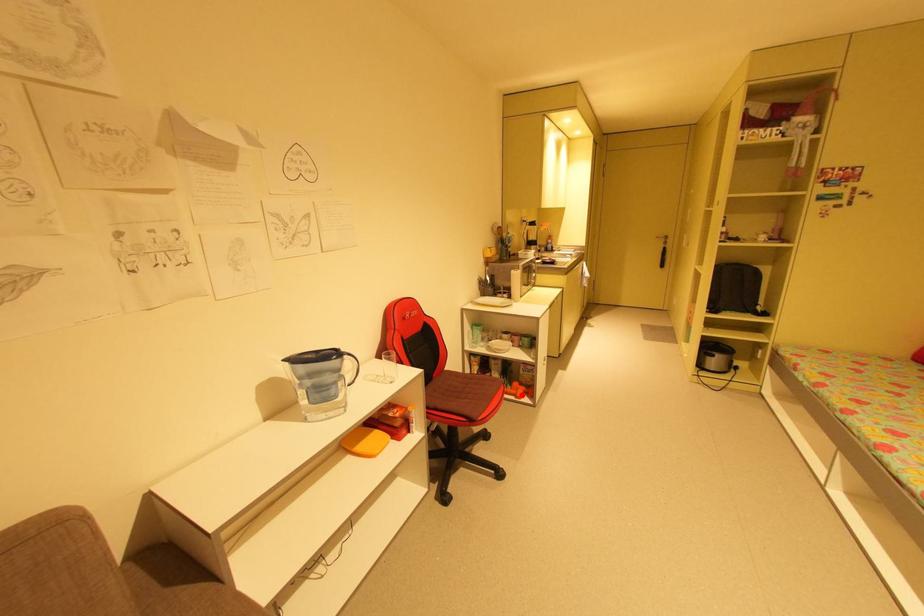
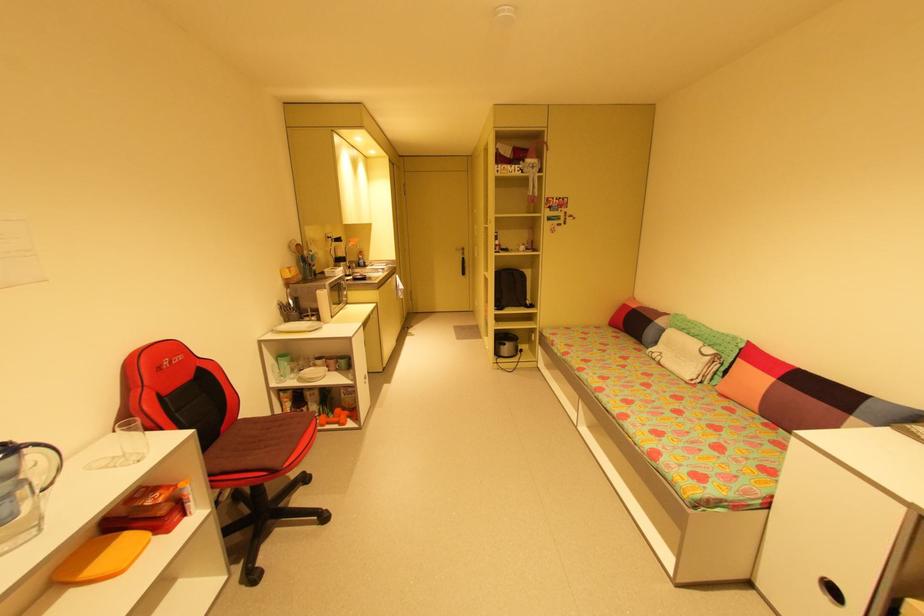
Question: I am providing you with two images of the same scene from different viewpoints. Given a red point in image1, look at the same physical point in image2. Is it:

Choices:
 (A) Closer to the viewpoint
 (B) Farther from the viewpoint

Answer: (A)